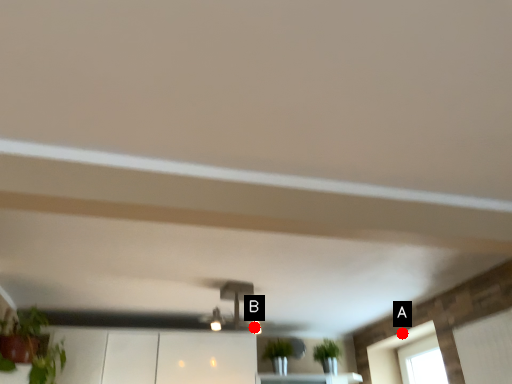
Question: Two points are circled on the image, labeled by A and B beside each circle. Which point appears closest to the camera in this image?

Choices:
 (A) A is closer
 (B) B is closer

Answer: (B)